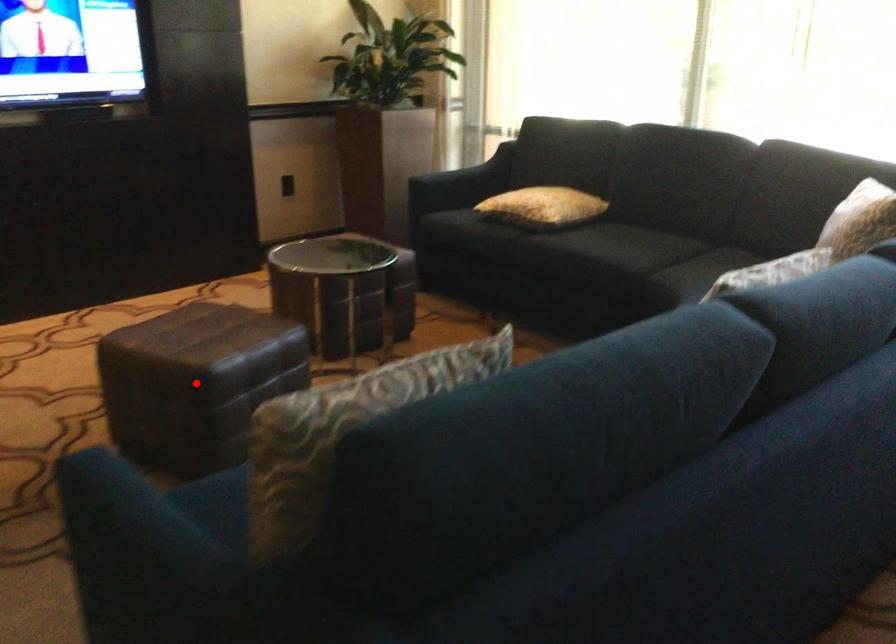
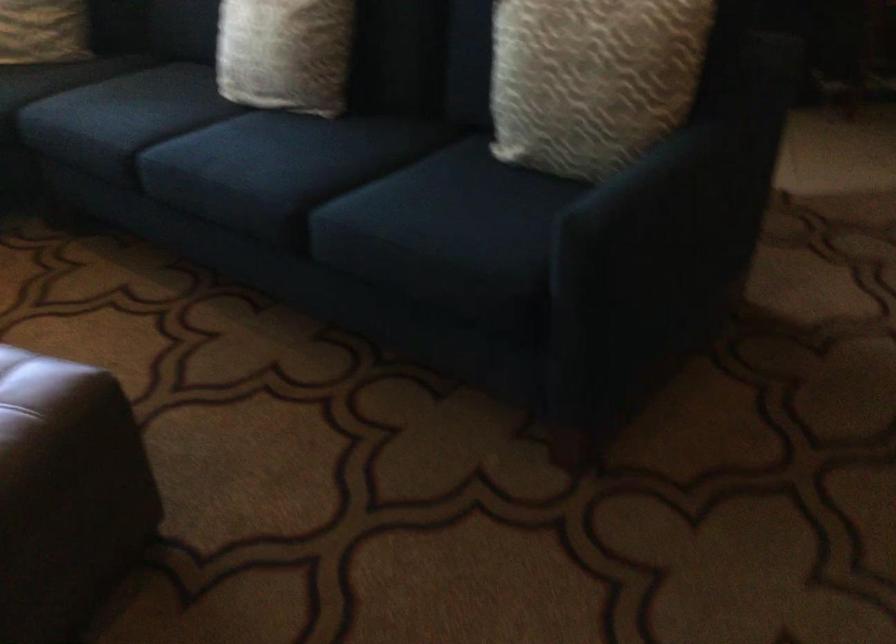
Question: I am providing you with two images of the same scene from different viewpoints. In image1, a red point is highlighted. Considering the same 3D point in image2, which of the following is correct?

Choices:
 (A) It is closer
 (B) It is farther

Answer: (A)